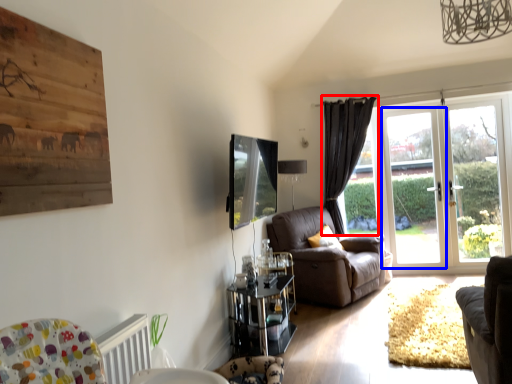
Question: Which point is closer to the camera, curtain (highlighted by a red box) or screen door (highlighted by a blue box)?

Choices:
 (A) curtain
 (B) screen door

Answer: (B)